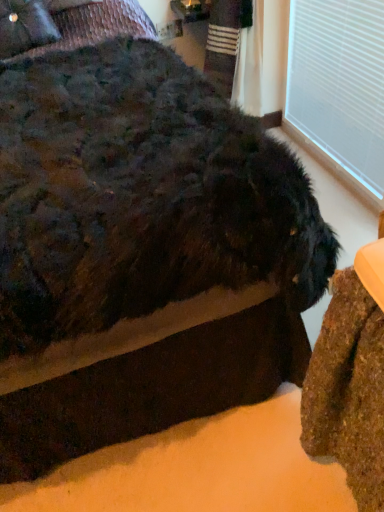
Question: Does fuzzy black dog at center have a larger size compared to white plastic window frame at upper right?

Choices:
 (A) no
 (B) yes

Answer: (B)

Question: From the image's perspective, is fuzzy black dog at center located beneath white plastic window frame at upper right?

Choices:
 (A) no
 (B) yes

Answer: (B)

Question: From the image's perspective, is fuzzy black dog at center above white plastic window frame at upper right?

Choices:
 (A) yes
 (B) no

Answer: (B)

Question: Is fuzzy black dog at center thinner than white plastic window frame at upper right?

Choices:
 (A) no
 (B) yes

Answer: (A)

Question: From a real-world perspective, is fuzzy black dog at center on top of white plastic window frame at upper right?

Choices:
 (A) yes
 (B) no

Answer: (A)

Question: Considering their positions, is white plastic window frame at upper right located in front of or behind fuzzy black dog at center?

Choices:
 (A) behind
 (B) front

Answer: (A)

Question: Is white plastic window frame at upper right inside the boundaries of fuzzy black dog at center, or outside?

Choices:
 (A) outside
 (B) inside

Answer: (A)

Question: Is white plastic window frame at upper right taller or shorter than fuzzy black dog at center?

Choices:
 (A) tall
 (B) short

Answer: (B)

Question: Based on their sizes in the image, would you say white plastic window frame at upper right is bigger or smaller than fuzzy black dog at center?

Choices:
 (A) big
 (B) small

Answer: (B)

Question: Is velvet-like dark brown pillow at upper left situated inside fuzzy black dog at center or outside?

Choices:
 (A) outside
 (B) inside

Answer: (B)

Question: From the image's perspective, is velvet-like dark brown pillow at upper left positioned above or below fuzzy black dog at center?

Choices:
 (A) below
 (B) above

Answer: (B)

Question: Is point (0, 13) positioned closer to the camera than point (165, 96)?

Choices:
 (A) farther
 (B) closer

Answer: (A)

Question: Is velvet-like dark brown pillow at upper left taller or shorter than fuzzy black dog at center?

Choices:
 (A) short
 (B) tall

Answer: (A)

Question: From their relative heights in the image, would you say velvet-like dark brown pillow at upper left is taller or shorter than white plastic window frame at upper right?

Choices:
 (A) short
 (B) tall

Answer: (A)

Question: In terms of width, does velvet-like dark brown pillow at upper left look wider or thinner when compared to white plastic window frame at upper right?

Choices:
 (A) thin
 (B) wide

Answer: (B)